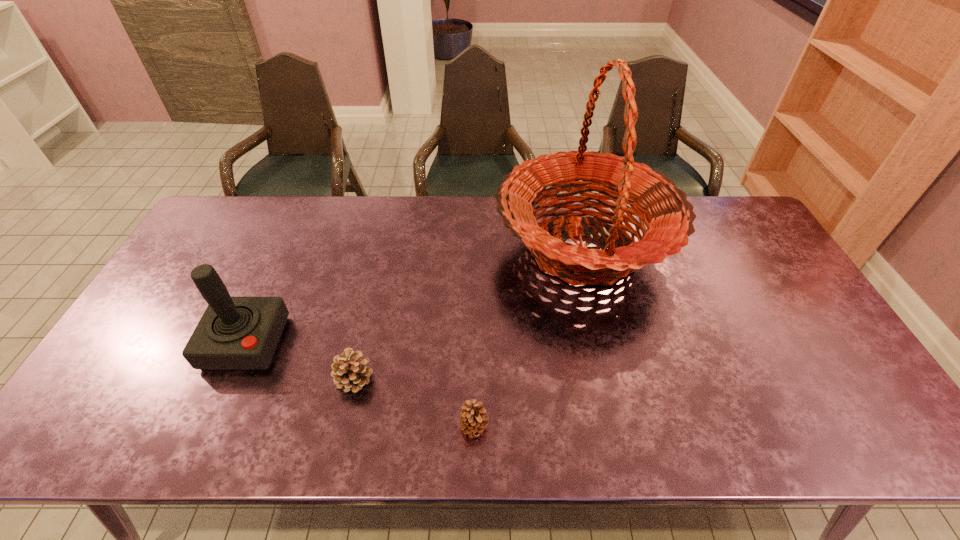
Where is `free space located on the left of the farther pinecone`? The height and width of the screenshot is (540, 960). free space located on the left of the farther pinecone is located at coordinates (186, 379).

This screenshot has width=960, height=540. What are the coordinates of `vacant space situated on the right of the nearer pinecone` in the screenshot? It's located at 549,427.

Where is `object that is at the far edge`? This screenshot has width=960, height=540. object that is at the far edge is located at coordinates (668, 216).

Where is `object that is positioned at the near edge`? This screenshot has height=540, width=960. object that is positioned at the near edge is located at coordinates (473, 418).

You are a GUI agent. You are given a task and a screenshot of the screen. Output one action in this format:
    pyautogui.click(x=<x>, y=<y>)
    Task: Click on the blank space at the far edge
    The height and width of the screenshot is (540, 960).
    Given the screenshot: What is the action you would take?
    pyautogui.click(x=454, y=234)

Image resolution: width=960 pixels, height=540 pixels. In order to click on vacant area at the near edge in this screenshot , I will do `click(229, 443)`.

Image resolution: width=960 pixels, height=540 pixels. I want to click on free point at the right edge, so click(782, 303).

Where is `vacant space at the far right corner`? This screenshot has height=540, width=960. vacant space at the far right corner is located at coordinates (729, 225).

Where is `free area in between the tallest object and the nearest object`? The image size is (960, 540). free area in between the tallest object and the nearest object is located at coordinates click(528, 338).

You are a GUI agent. You are given a task and a screenshot of the screen. Output one action in this format:
    pyautogui.click(x=<x>, y=<y>)
    Task: Click on the empty space that is in between the left pinecone and the third shortest object
    This screenshot has height=540, width=960.
    Given the screenshot: What is the action you would take?
    [300, 361]